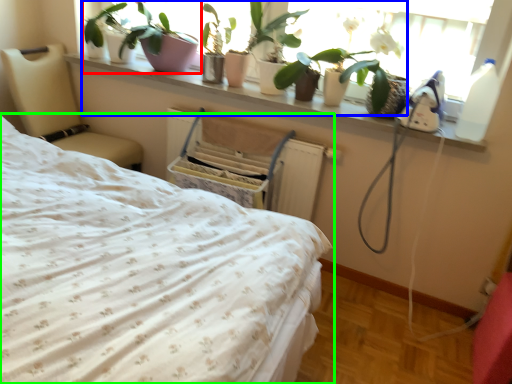
Question: Which object is the farthest from houseplant (highlighted by a red box)? Choose among these: plant (highlighted by a blue box) or bed (highlighted by a green box).

Choices:
 (A) plant
 (B) bed

Answer: (B)